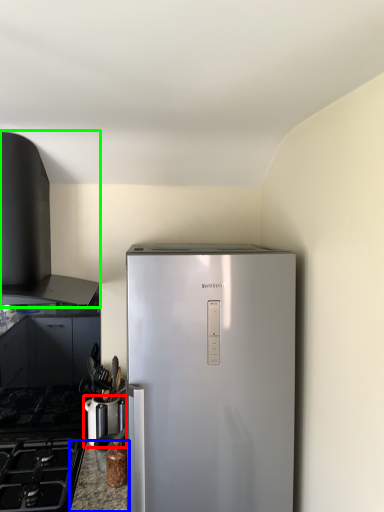
Question: Which object is the farthest from appliance (highlighted by a red box)? Choose among these: counter top (highlighted by a blue box) or vent (highlighted by a green box).

Choices:
 (A) counter top
 (B) vent

Answer: (B)